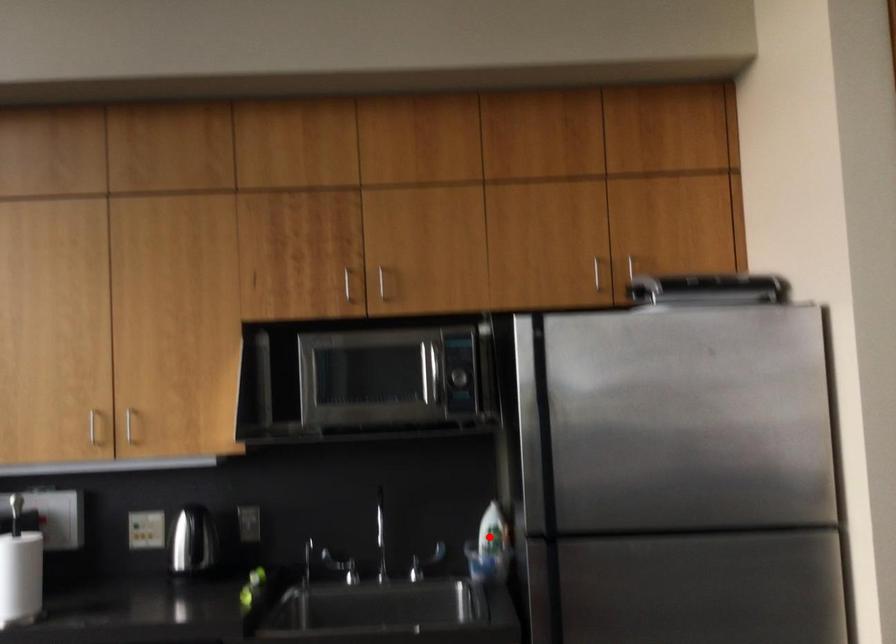
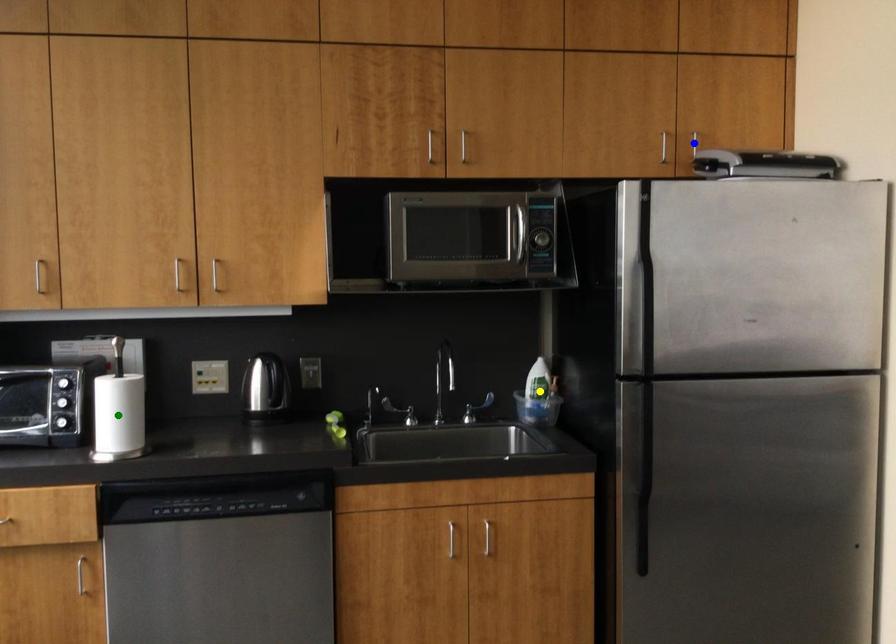
Question: I am providing you with two images of the same scene from different viewpoints. A red point is marked on the first image. You are given multiple points on the second image. Which spot in image 2 lines up with the point in image 1?

Choices:
 (A) blue point
 (B) yellow point
 (C) green point

Answer: (B)